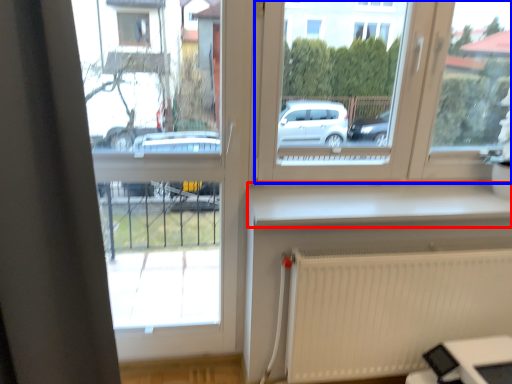
Question: Which object appears farthest to the camera in this image, window sill (highlighted by a red box) or window (highlighted by a blue box)?

Choices:
 (A) window sill
 (B) window

Answer: (A)